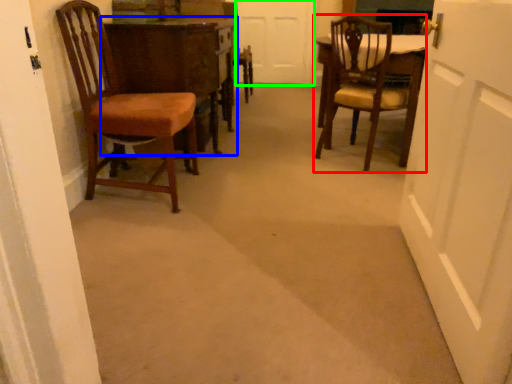
Question: Based on their relative distances, which object is nearer to chair (highlighted by a red box)? Choose from table (highlighted by a blue box) and door (highlighted by a green box).

Choices:
 (A) table
 (B) door

Answer: (A)